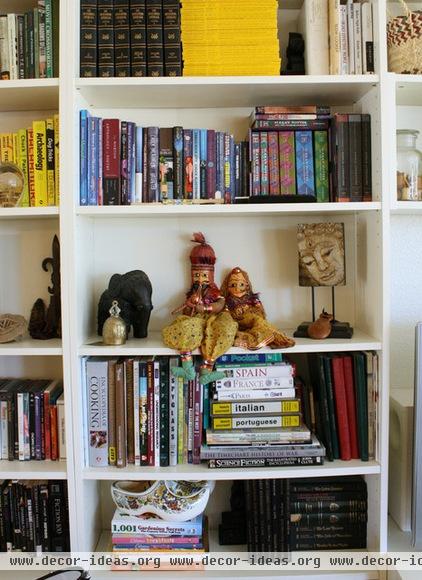
Identify the location of books on bottom shelf of bookcase on the left. (61, 527), (46, 531), (40, 539), (31, 528), (26, 534), (17, 536), (8, 541).